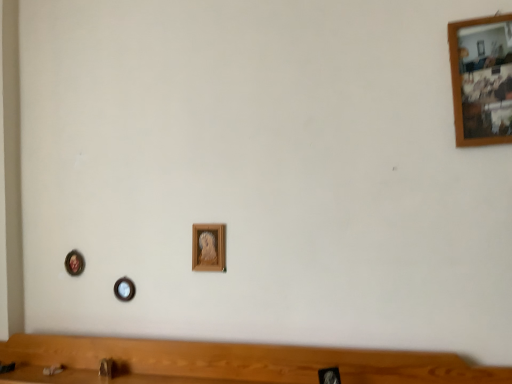
The width and height of the screenshot is (512, 384). What are the coordinates of `matte brown faucet at lower center` in the screenshot? It's located at (106, 368).

Locate an element on the screen. Image resolution: width=512 pixels, height=384 pixels. wooden picture frame at upper right, the first picture frame when ordered from top to bottom is located at coordinates (482, 80).

What do you see at coordinates (208, 247) in the screenshot? I see `wooden picture frame at center, which is the second picture frame in right-to-left order` at bounding box center [208, 247].

What do you see at coordinates (124, 289) in the screenshot?
I see `wooden picture frame at center, the 3th picture frame when ordered from front to back` at bounding box center [124, 289].

This screenshot has width=512, height=384. Find the location of `matte brown faucet at lower center`. matte brown faucet at lower center is located at coordinates (106, 368).

From a real-world perspective, is metallic circular frame at lower left, the third picture frame when ordered from top to bottom, on matte brown faucet at lower center?

Yes, from a real-world perspective, metallic circular frame at lower left, the third picture frame when ordered from top to bottom, is above matte brown faucet at lower center.

What's the angular difference between metallic circular frame at lower left, acting as the first picture frame starting from the back, and matte brown faucet at lower center's facing directions?

The facing directions of metallic circular frame at lower left, acting as the first picture frame starting from the back, and matte brown faucet at lower center are 19.8 degrees apart.

Between metallic circular frame at lower left, acting as the first picture frame starting from the back, and matte brown faucet at lower center, which one has larger size?

metallic circular frame at lower left, acting as the first picture frame starting from the back.

Which of these two, metallic circular frame at lower left, marked as the 2th picture frame in a bottom-to-top arrangement, or matte brown faucet at lower center, stands taller?

metallic circular frame at lower left, marked as the 2th picture frame in a bottom-to-top arrangement, is taller.

Looking at this image, considering the sizes of wooden picture frame at upper right, which is the 4th picture frame in left-to-right order, and wooden picture frame at center, which is counted as the 1th picture frame, starting from the bottom, in the image, is wooden picture frame at upper right, which is the 4th picture frame in left-to-right order, bigger or smaller than wooden picture frame at center, which is counted as the 1th picture frame, starting from the bottom,?

wooden picture frame at upper right, which is the 4th picture frame in left-to-right order, is bigger than wooden picture frame at center, which is counted as the 1th picture frame, starting from the bottom.

Which point is more forward, [507,142] or [130,282]?

The point [507,142] is more forward.

Based on the photo, does wooden picture frame at upper right, which appears as the 1th picture frame when viewed from the right, have a greater height compared to wooden picture frame at center, which is counted as the 1th picture frame, starting from the bottom?

Yes.

Is wooden picture frame at upper right, marked as the 4th picture frame in a bottom-to-top arrangement, placed right next to wooden picture frame at center, the 4th picture frame from the top?

wooden picture frame at upper right, marked as the 4th picture frame in a bottom-to-top arrangement, and wooden picture frame at center, the 4th picture frame from the top, are not in contact.

Is wooden picture frame at center, the 2th picture frame viewed from the left, taller than matte brown faucet at lower center?

Correct, wooden picture frame at center, the 2th picture frame viewed from the left, is much taller as matte brown faucet at lower center.

Considering the sizes of objects wooden picture frame at center, which is counted as the 1th picture frame, starting from the bottom, and matte brown faucet at lower center in the image provided, who is smaller, wooden picture frame at center, which is counted as the 1th picture frame, starting from the bottom, or matte brown faucet at lower center?

matte brown faucet at lower center.

Is wooden picture frame at center, the 3th picture frame when ordered from front to back, placed right next to matte brown faucet at lower center?

No, wooden picture frame at center, the 3th picture frame when ordered from front to back, is not beside matte brown faucet at lower center.

At what (x,y) coordinates should I click in order to perform the action: click on faucet lying below the wooden picture frame at upper right, which appears as the 4th picture frame when viewed from the back (from the image's perspective). Please return your answer as a coordinate pair (x, y). The image size is (512, 384). Looking at the image, I should click on (106, 368).

Considering the relative sizes of wooden picture frame at upper right, which appears as the 1th picture frame when viewed from the right, and matte brown faucet at lower center in the image provided, is wooden picture frame at upper right, which appears as the 1th picture frame when viewed from the right, shorter than matte brown faucet at lower center?

No.

Is wooden picture frame at upper right, acting as the 1th picture frame starting from the front, positioned beyond the bounds of matte brown faucet at lower center?

Indeed, wooden picture frame at upper right, acting as the 1th picture frame starting from the front, is completely outside matte brown faucet at lower center.

Which point is more forward, (105, 371) or (77, 270)?

The point (105, 371) is more forward.

Which of these two, matte brown faucet at lower center or metallic circular frame at lower left, marked as the 2th picture frame in a bottom-to-top arrangement, is bigger?

metallic circular frame at lower left, marked as the 2th picture frame in a bottom-to-top arrangement.

From the image's perspective, which is above, matte brown faucet at lower center or metallic circular frame at lower left, which appears as the 4th picture frame when viewed from the right?

metallic circular frame at lower left, which appears as the 4th picture frame when viewed from the right.

From a real-world perspective, is matte brown faucet at lower center on top of metallic circular frame at lower left, acting as the first picture frame starting from the back?

No, from a real-world perspective, matte brown faucet at lower center is not on top of metallic circular frame at lower left, acting as the first picture frame starting from the back.

Relative to wooden picture frame at upper right, marked as the 4th picture frame in a bottom-to-top arrangement, is matte brown faucet at lower center in front or behind?

matte brown faucet at lower center is positioned farther from the viewer than wooden picture frame at upper right, marked as the 4th picture frame in a bottom-to-top arrangement.

Where is `faucet on the left of wooden picture frame at upper right, which appears as the 4th picture frame when viewed from the back`? faucet on the left of wooden picture frame at upper right, which appears as the 4th picture frame when viewed from the back is located at coordinates (106, 368).

Based on the photo, can you confirm if matte brown faucet at lower center is positioned to the left of wooden picture frame at upper right, which appears as the 1th picture frame when viewed from the right?

Correct, you'll find matte brown faucet at lower center to the left of wooden picture frame at upper right, which appears as the 1th picture frame when viewed from the right.

How different are the orientations of matte brown faucet at lower center and wooden picture frame at upper right, which appears as the 1th picture frame when viewed from the right, in degrees?

They differ by 20.9 degrees in their facing directions.

From the metallic circular frame at lower left, marked as the 2th picture frame in a bottom-to-top arrangement, count 2nd picture frames forward and point to it. Please provide its 2D coordinates.

[(208, 247)]

Based on the photo, is metallic circular frame at lower left, acting as the first picture frame starting from the back, smaller than wooden picture frame at center, which is the second picture frame in right-to-left order?

Yes.

Considering the sizes of objects metallic circular frame at lower left, which appears as the 4th picture frame when viewed from the right, and wooden picture frame at center, placed as the second picture frame when sorted from front to back, in the image provided, who is taller, metallic circular frame at lower left, which appears as the 4th picture frame when viewed from the right, or wooden picture frame at center, placed as the second picture frame when sorted from front to back,?

wooden picture frame at center, placed as the second picture frame when sorted from front to back, is taller.

What's the angular difference between metallic circular frame at lower left, which appears as the 4th picture frame when viewed from the right, and wooden picture frame at center, positioned as the 3th picture frame in bottom-to-top order,'s facing directions?

The facing directions of metallic circular frame at lower left, which appears as the 4th picture frame when viewed from the right, and wooden picture frame at center, positioned as the 3th picture frame in bottom-to-top order, are 0.0502 degrees apart.

The height and width of the screenshot is (384, 512). Identify the location of faucet below the metallic circular frame at lower left, the first picture frame positioned from the left (from a real-world perspective). (106, 368).

This screenshot has width=512, height=384. What are the coordinates of `the 2nd picture frame behind the wooden picture frame at upper right, marked as the 4th picture frame in a bottom-to-top arrangement` in the screenshot? It's located at (124, 289).

Considering their positions, is wooden picture frame at center, the 2th picture frame viewed from the left, positioned further to wooden picture frame at upper right, which appears as the 1th picture frame when viewed from the right, than matte brown faucet at lower center?

matte brown faucet at lower center is positioned further to the anchor wooden picture frame at upper right, which appears as the 1th picture frame when viewed from the right.

Estimate the real-world distances between objects in this image. Which object is closer to wooden picture frame at center, which is the second picture frame in right-to-left order, wooden picture frame at upper right, which is the 4th picture frame in left-to-right order, or wooden picture frame at center, the 4th picture frame from the top?

wooden picture frame at center, the 4th picture frame from the top.

When comparing their distances from wooden picture frame at center, the 2th picture frame viewed from the left, does matte brown faucet at lower center or wooden picture frame at upper right, which appears as the 1th picture frame when viewed from the right, seem closer?

The object closer to wooden picture frame at center, the 2th picture frame viewed from the left, is matte brown faucet at lower center.

From the image, which object appears to be farther from wooden picture frame at center, which is counted as the third picture frame, starting from the back, metallic circular frame at lower left, the first picture frame positioned from the left, or matte brown faucet at lower center?

Based on the image, metallic circular frame at lower left, the first picture frame positioned from the left, appears to be further to wooden picture frame at center, which is counted as the third picture frame, starting from the back.

Based on their spatial positions, is wooden picture frame at center, acting as the 2th picture frame starting from the top, or metallic circular frame at lower left, the third picture frame when ordered from top to bottom, further from matte brown faucet at lower center?

wooden picture frame at center, acting as the 2th picture frame starting from the top, is positioned further to the anchor matte brown faucet at lower center.

Based on their spatial positions, is wooden picture frame at center, which is the second picture frame in right-to-left order, or matte brown faucet at lower center closer to wooden picture frame at center, which is the 3th picture frame from right to left?

Among the two, matte brown faucet at lower center is located nearer to wooden picture frame at center, which is the 3th picture frame from right to left.

Which object lies nearer to the anchor point wooden picture frame at center, which is the second picture frame in right-to-left order, wooden picture frame at center, which is counted as the 1th picture frame, starting from the bottom, or matte brown faucet at lower center?

wooden picture frame at center, which is counted as the 1th picture frame, starting from the bottom, lies closer to wooden picture frame at center, which is the second picture frame in right-to-left order, than the other object.

Considering their positions, is matte brown faucet at lower center positioned closer to wooden picture frame at upper right, the first picture frame when ordered from top to bottom, than wooden picture frame at center, acting as the 2th picture frame starting from the back?

wooden picture frame at center, acting as the 2th picture frame starting from the back.

The height and width of the screenshot is (384, 512). I want to click on faucet between metallic circular frame at lower left, which appears as the 4th picture frame when viewed from the right, and wooden picture frame at upper right, which appears as the 4th picture frame when viewed from the back, from left to right, so click(106, 368).

The height and width of the screenshot is (384, 512). Identify the location of picture frame between wooden picture frame at center, which is the 3th picture frame from right to left, and wooden picture frame at upper right, the first picture frame when ordered from top to bottom, from left to right. (208, 247).

The height and width of the screenshot is (384, 512). I want to click on picture frame between metallic circular frame at lower left, which is the fourth picture frame from front to back, and matte brown faucet at lower center in the up-down direction, so click(x=124, y=289).

Image resolution: width=512 pixels, height=384 pixels. I want to click on faucet situated between metallic circular frame at lower left, marked as the 2th picture frame in a bottom-to-top arrangement, and wooden picture frame at center, positioned as the 3th picture frame in bottom-to-top order, from left to right, so pos(106,368).